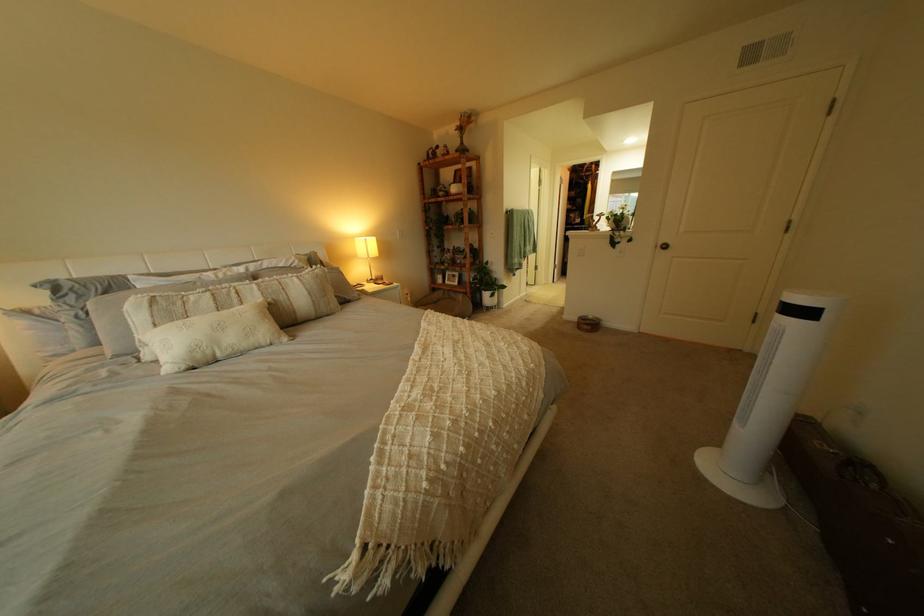
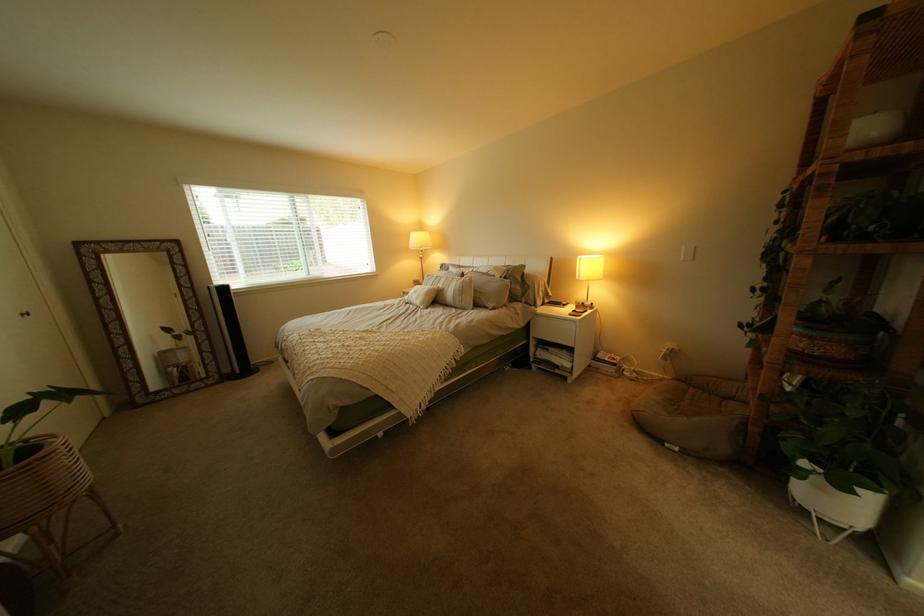
In the second image, find the point that corresponds to point 236,329 in the first image.

(431, 293)